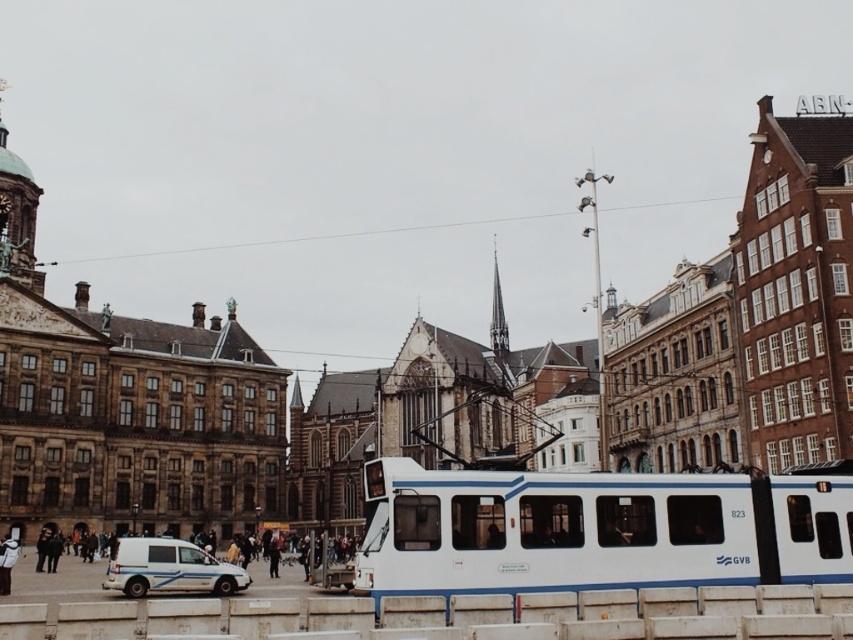
Between white glossy passenger train at center and white matte van at lower left, which one has more height?

white glossy passenger train at center is taller.

Which of these two, white glossy passenger train at center or white matte van at lower left, stands shorter?

white matte van at lower left is shorter.

Does point (413, 465) come farther from viewer compared to point (228, 579)?

No, (413, 465) is closer to viewer.

This screenshot has height=640, width=853. Identify the location of white glossy passenger train at center. (596, 529).